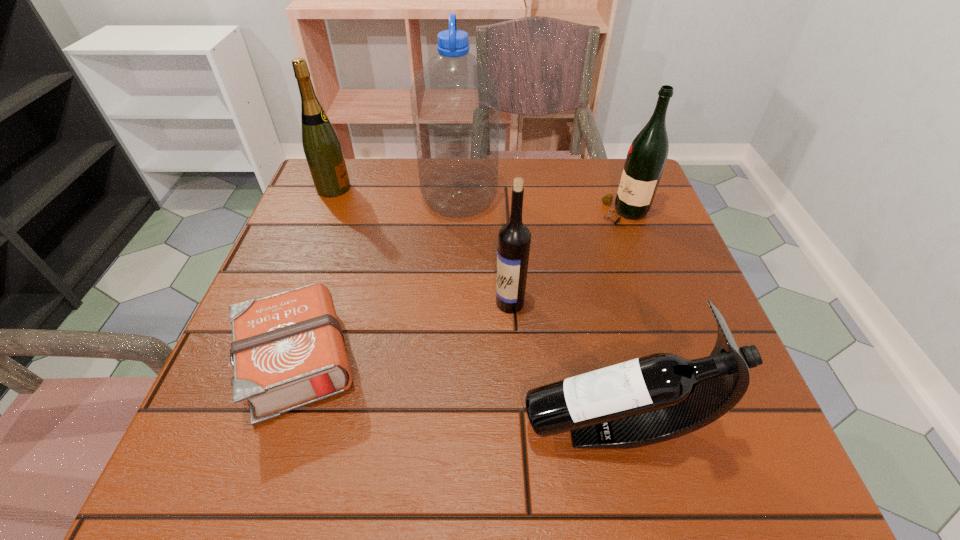
Image resolution: width=960 pixels, height=540 pixels. In order to click on wine bottle present at the left edge in this screenshot , I will do `click(322, 148)`.

Where is `Bible that is at the left edge`? The image size is (960, 540). Bible that is at the left edge is located at coordinates (288, 351).

Image resolution: width=960 pixels, height=540 pixels. What are the coordinates of `object located at the far left corner` in the screenshot? It's located at (322, 148).

You are a GUI agent. You are given a task and a screenshot of the screen. Output one action in this format:
    pyautogui.click(x=<x>, y=<y>)
    Task: Click on the object that is at the far right corner
    The height and width of the screenshot is (540, 960).
    Given the screenshot: What is the action you would take?
    pyautogui.click(x=646, y=158)

Locate an element on the screen. The height and width of the screenshot is (540, 960). object at the near right corner is located at coordinates (662, 396).

In the image, there is a desktop. At what (x,y) coordinates should I click in order to perform the action: click on blank space at the far edge. Please return your answer as a coordinate pair (x, y). Image resolution: width=960 pixels, height=540 pixels. Looking at the image, I should click on (545, 176).

Image resolution: width=960 pixels, height=540 pixels. What are the coordinates of `vacant region at the near edge` in the screenshot? It's located at (467, 433).

This screenshot has width=960, height=540. In the image, there is a desktop. What are the coordinates of `vacant space at the left edge` in the screenshot? It's located at (308, 253).

Identify the location of vacant space at the right edge of the desktop. The height and width of the screenshot is (540, 960). (660, 273).

Locate an element on the screen. vacant space at the near left corner of the desktop is located at coordinates (288, 430).